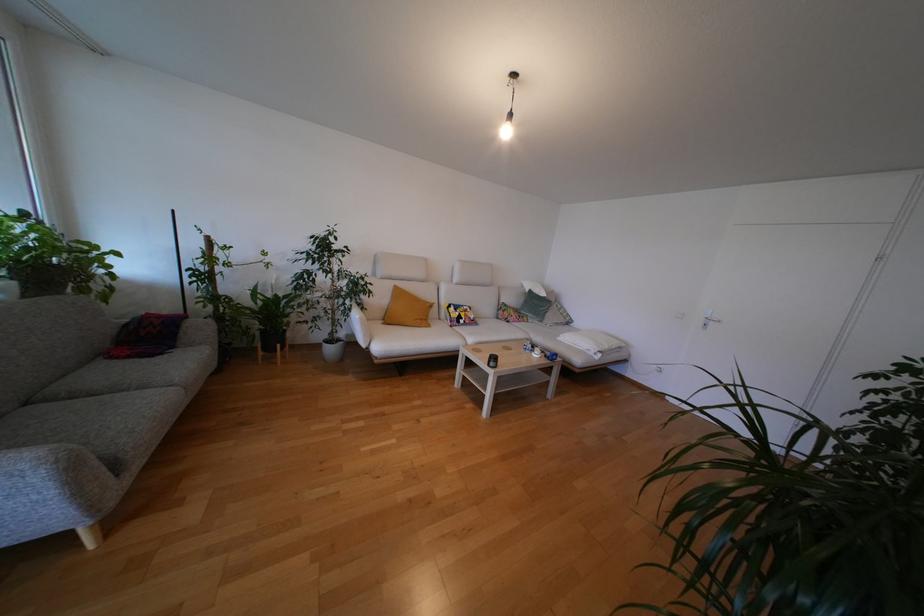
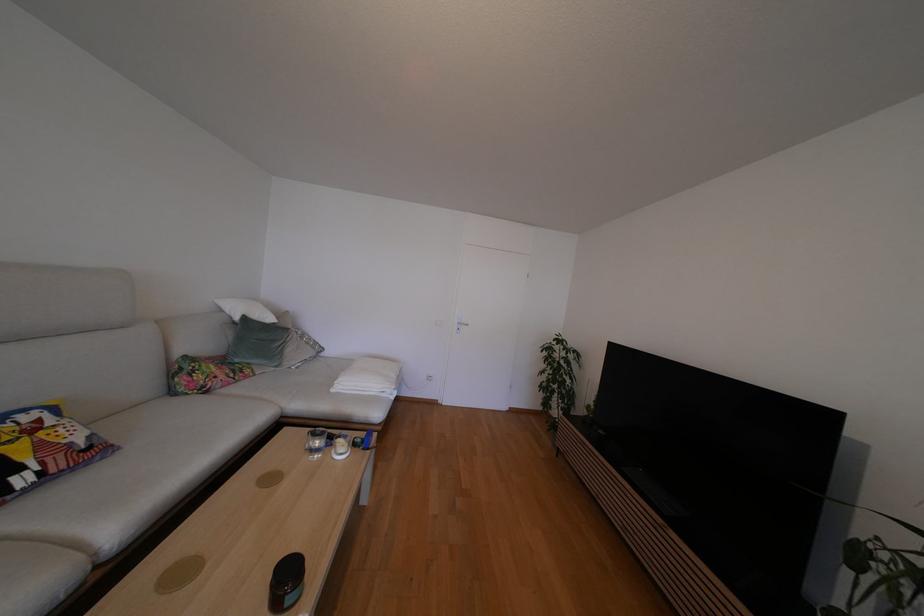
In the second image, find the point that corresponds to point 466,308 in the first image.

(6, 419)